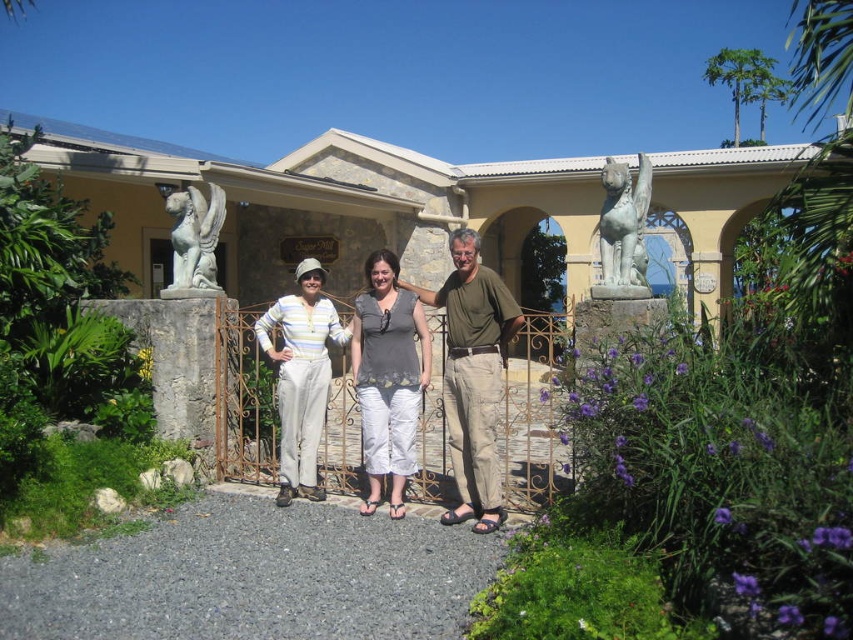
Question: Does purple matte flowers at center appear on the left side of bronze statue at upper right?

Choices:
 (A) yes
 (B) no

Answer: (A)

Question: Estimate the real-world distances between objects in this image. Which object is farther from the stone statue at left?

Choices:
 (A) bronze statue at upper right
 (B) gray cotton shirt at center
 (C) white striped pants at center

Answer: (A)

Question: Does purple matte flowers at center come behind stone statue at left?

Choices:
 (A) yes
 (B) no

Answer: (B)

Question: Is purple matte flowers at center to the right of white striped pants at center from the viewer's perspective?

Choices:
 (A) yes
 (B) no

Answer: (A)

Question: Which of these objects is positioned farthest from the gray cotton shirt at center?

Choices:
 (A) purple matte flowers at center
 (B) stone statue at left

Answer: (B)

Question: Which of the following is the farthest from the observer?

Choices:
 (A) pyautogui.click(x=190, y=280)
 (B) pyautogui.click(x=641, y=161)

Answer: (A)